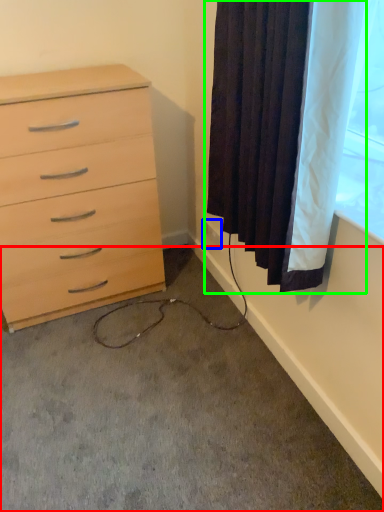
Question: Estimate the real-world distances between objects in this image. Which object is closer to concrete (highlighted by a red box), electric outlet (highlighted by a blue box) or curtain (highlighted by a green box)?

Choices:
 (A) electric outlet
 (B) curtain

Answer: (B)